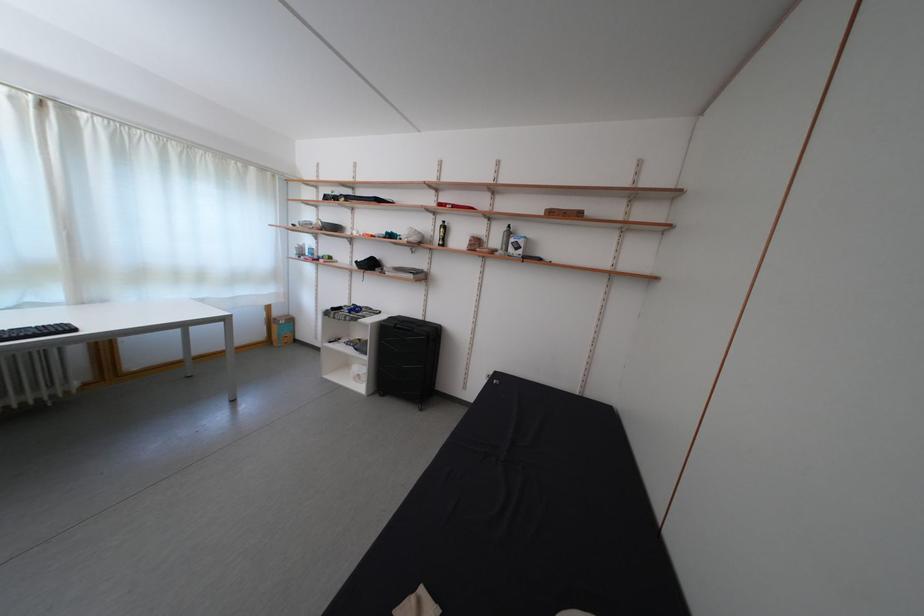
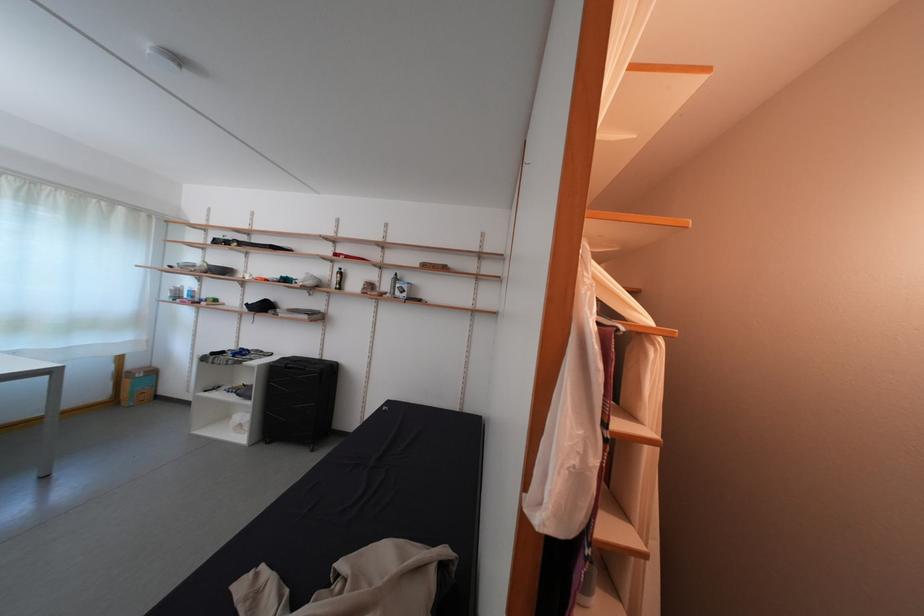
Where in the second image is the point corresponding to point 442,241 from the first image?

(339, 286)